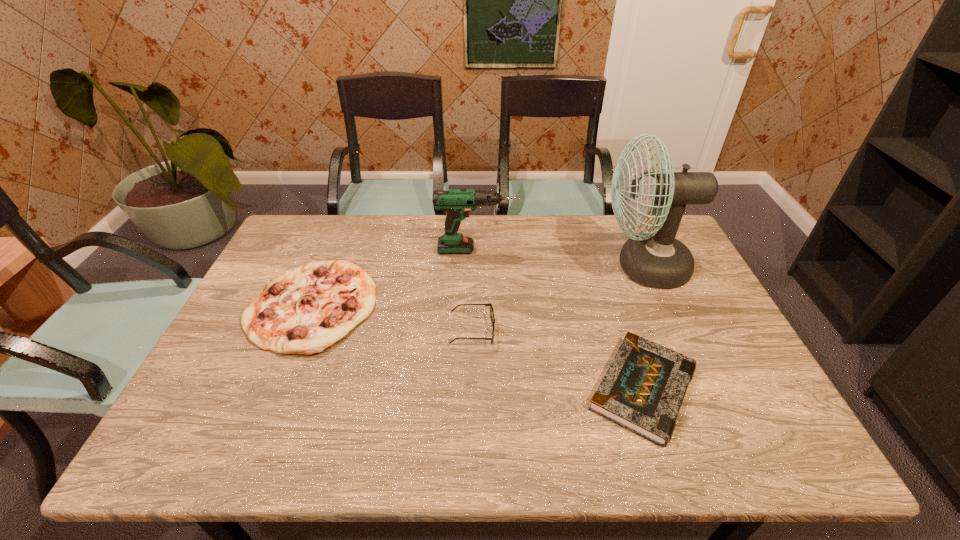
I want to click on fan, so click(656, 259).

Find the location of a particular element. Image resolution: width=960 pixels, height=540 pixels. drill is located at coordinates (457, 203).

Locate an element on the screen. Image resolution: width=960 pixels, height=540 pixels. the leftmost object is located at coordinates (302, 311).

Locate an element on the screen. The height and width of the screenshot is (540, 960). spectacles is located at coordinates (491, 307).

Find the location of a particular element. The width and height of the screenshot is (960, 540). the shortest object is located at coordinates (643, 388).

This screenshot has width=960, height=540. I want to click on vacant space located in front of the fan where the airflow is directed, so click(494, 267).

Where is `vacant space located in front of the fan where the airflow is directed`? vacant space located in front of the fan where the airflow is directed is located at coordinates [543, 267].

At what (x,y) coordinates should I click in order to perform the action: click on free location located 0.200m in front of the fan where the airflow is directed. Please return your answer as a coordinate pair (x, y). The width and height of the screenshot is (960, 540). Looking at the image, I should click on (534, 267).

Image resolution: width=960 pixels, height=540 pixels. I want to click on vacant space located on the handle side of the fourth shortest object, so (x=593, y=250).

Locate an element on the screen. vacant space located on the right of the leftmost object is located at coordinates (468, 306).